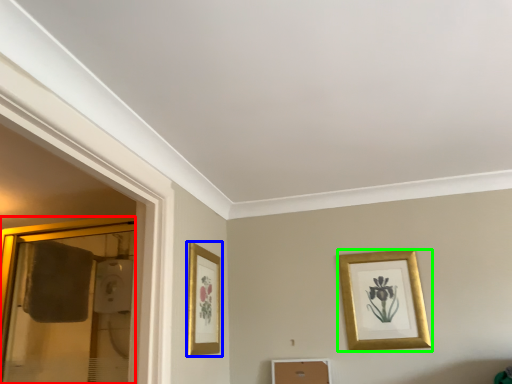
Question: Estimate the real-world distances between objects in this image. Which object is closer to glass door (highlighted by a red box), picture frame (highlighted by a blue box) or picture frame (highlighted by a green box)?

Choices:
 (A) picture frame
 (B) picture frame

Answer: (A)